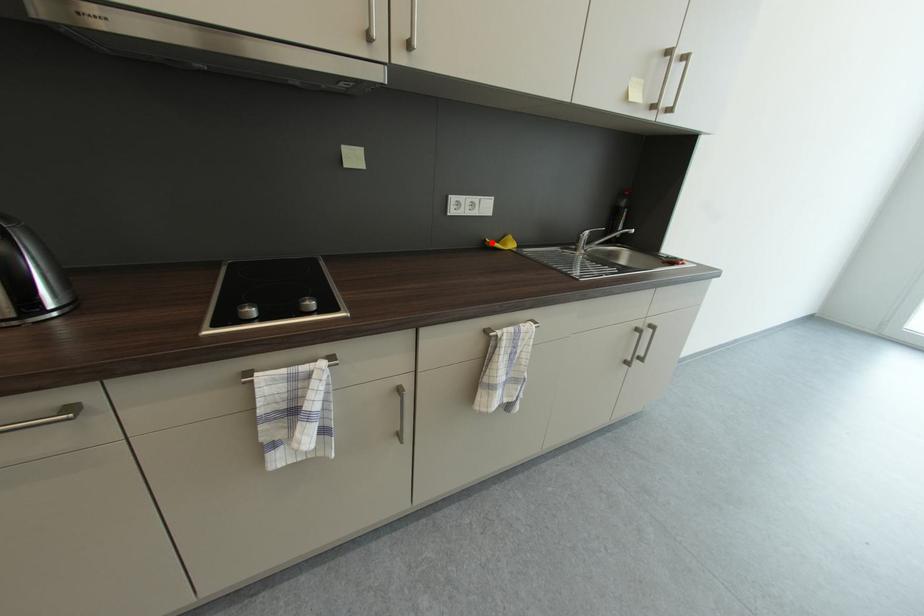
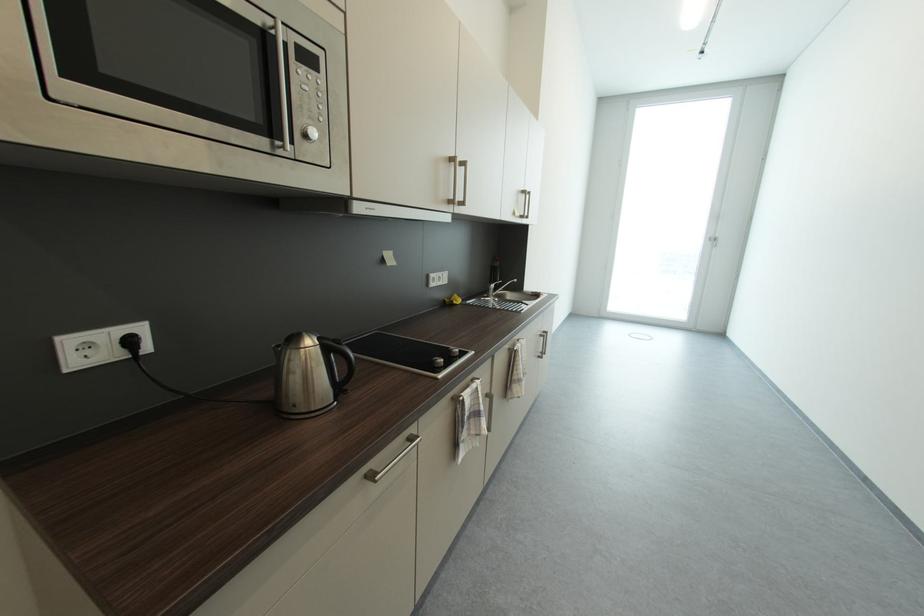
Locate, in the second image, the point that corresponds to the highlighted location in the first image.

(453, 302)